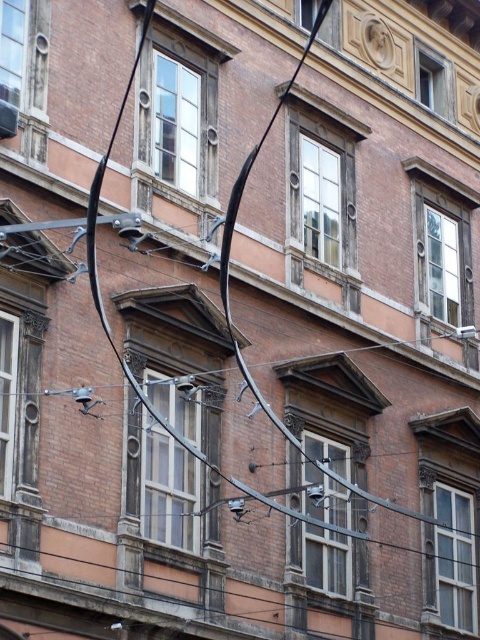
Question: Among these objects, which one is farthest from the camera?

Choices:
 (A) matte glass window at upper center
 (B) matte brown wood window at right
 (C) clear glass window at upper left
 (D) clear glass window at upper center

Answer: (D)

Question: Is matte brick window at center closer to camera compared to wooden window at left?

Choices:
 (A) no
 (B) yes

Answer: (A)

Question: Where is matte brown wood window at right located in relation to clear glass window at upper center in the image?

Choices:
 (A) left
 (B) right

Answer: (B)

Question: Which point is closer to the camera?

Choices:
 (A) pyautogui.click(x=8, y=314)
 (B) pyautogui.click(x=439, y=83)
 (C) pyautogui.click(x=301, y=6)

Answer: (A)

Question: Which of the following is the closest to the observer?

Choices:
 (A) clear glass window at center
 (B) wooden window at left
 (C) clear glass window at upper left

Answer: (B)

Question: Does wooden window at center have a larger size compared to matte brown wood window at right?

Choices:
 (A) yes
 (B) no

Answer: (B)